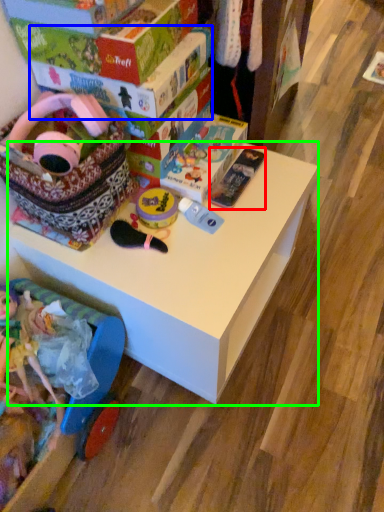
Question: Which is nearer to the toy (highlighted by a red box)? box (highlighted by a blue box) or table (highlighted by a green box).

Choices:
 (A) box
 (B) table

Answer: (B)